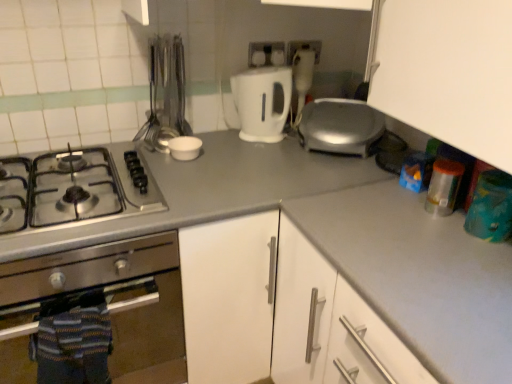
The width and height of the screenshot is (512, 384). I want to click on free location above white matte counter top at center (from a real-world perspective), so click(432, 253).